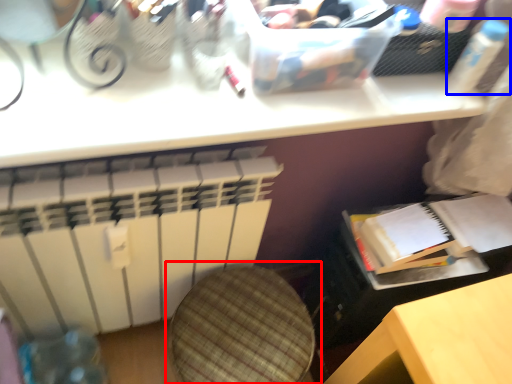
Question: Which point is further to the camera, swivel chair (highlighted by a red box) or bottle (highlighted by a blue box)?

Choices:
 (A) swivel chair
 (B) bottle

Answer: (B)